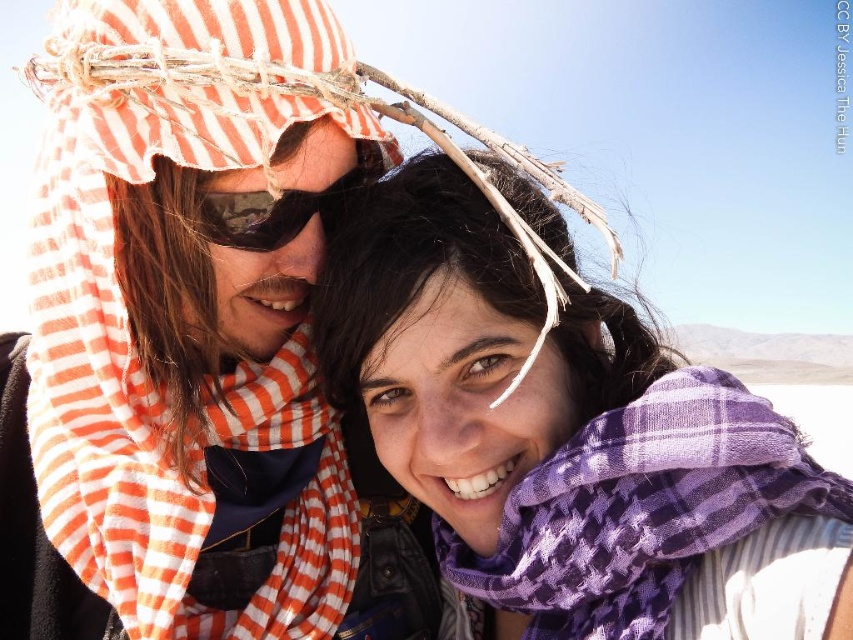
Is purple plaid scarf at center smaller than camouflage lens goggles at center?

No, purple plaid scarf at center is not smaller than camouflage lens goggles at center.

Can you confirm if purple plaid scarf at center is taller than camouflage lens goggles at center?

Yes.

Between point (643, 340) and point (262, 205), which one is positioned in front?

Point (262, 205) is in front.

At what (x,y) coordinates should I click in order to perform the action: click on purple plaid scarf at center. Please return your answer as a coordinate pair (x, y). Looking at the image, I should click on (567, 442).

Which is more to the right, orange striped scarf at upper left or purple checkered scarf at center?

Positioned to the right is purple checkered scarf at center.

Is orange striped scarf at upper left shorter than purple checkered scarf at center?

No, orange striped scarf at upper left is not shorter than purple checkered scarf at center.

Is point (180, 531) positioned before point (726, 504)?

No, (180, 531) is behind (726, 504).

This screenshot has height=640, width=853. Find the location of `orange striped scarf at upper left`. orange striped scarf at upper left is located at coordinates (194, 346).

Who is shorter, orange striped scarf at upper left or purple plaid scarf at center?

purple plaid scarf at center is shorter.

Is point (138, 72) farther from viewer compared to point (544, 605)?

No, (138, 72) is in front of (544, 605).

At what (x,y) coordinates should I click in order to perform the action: click on orange striped scarf at upper left. Please return your answer as a coordinate pair (x, y). The image size is (853, 640). Looking at the image, I should click on coord(194,346).